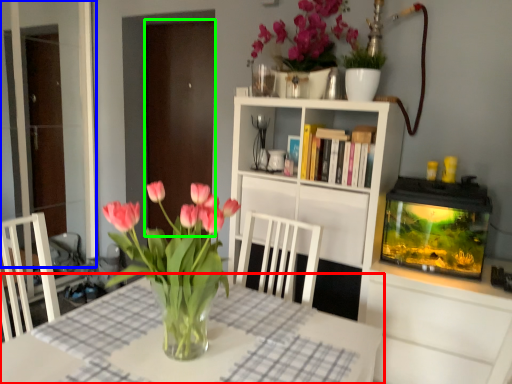
Question: Which object is the closest to the table (highlighted by a red box)? Choose among these: glass door (highlighted by a blue box) or glass door (highlighted by a green box).

Choices:
 (A) glass door
 (B) glass door

Answer: (B)